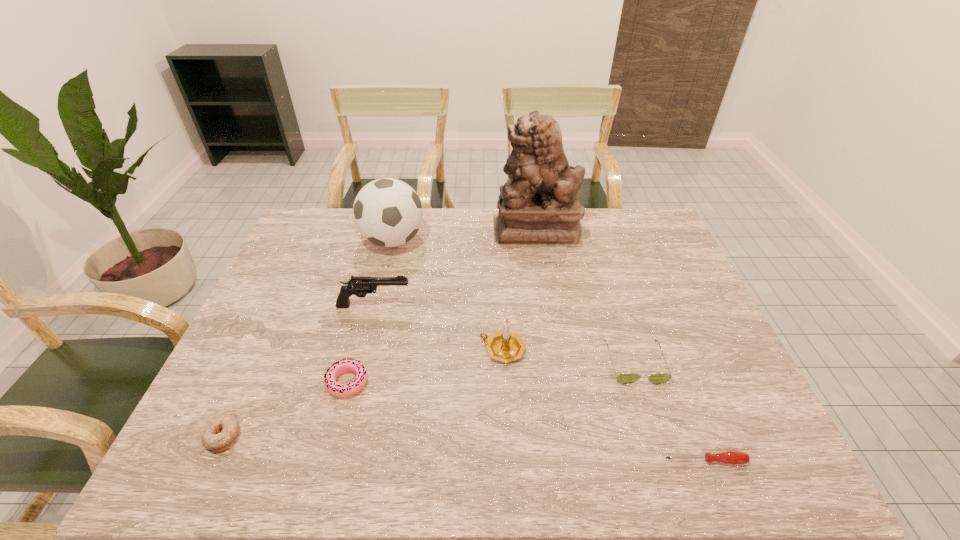
This screenshot has height=540, width=960. Find the location of `vacant space positioned 0.350m on the front-facing side of the sculpture`. vacant space positioned 0.350m on the front-facing side of the sculpture is located at coordinates (392, 231).

This screenshot has height=540, width=960. What are the coordinates of `vacant area located 0.170m on the front-facing side of the sculpture` in the screenshot? It's located at (444, 231).

Locate an element on the screen. blank space located on the front-facing side of the sculpture is located at coordinates (395, 231).

You are a GUI agent. You are given a task and a screenshot of the screen. Output one action in this format:
    pyautogui.click(x=<x>, y=<y>)
    Task: Click on the vacant space positioned 0.270m on the right of the second tallest object
    The width and height of the screenshot is (960, 540).
    Given the screenshot: What is the action you would take?
    pyautogui.click(x=506, y=240)

The height and width of the screenshot is (540, 960). In order to click on blank space located on the left of the candle holder in this screenshot , I will do `click(379, 350)`.

The width and height of the screenshot is (960, 540). Identify the location of free location located 0.290m at the end of the barrel of the third farthest object. (514, 306).

What are the coordinates of `vacant space located 0.090m on the front-facing side of the fifth tallest object` in the screenshot? It's located at (653, 419).

Where is `vacant space located 0.070m on the front of the right doughnut`? This screenshot has height=540, width=960. vacant space located 0.070m on the front of the right doughnut is located at coordinates (335, 428).

At what (x,y) coordinates should I click in order to perform the action: click on free location located on the right of the seventh farthest object. Please return your answer as a coordinate pair (x, y). Looking at the image, I should click on (351, 436).

The image size is (960, 540). Find the location of `free space located on the left of the nearest object`. free space located on the left of the nearest object is located at coordinates (481, 461).